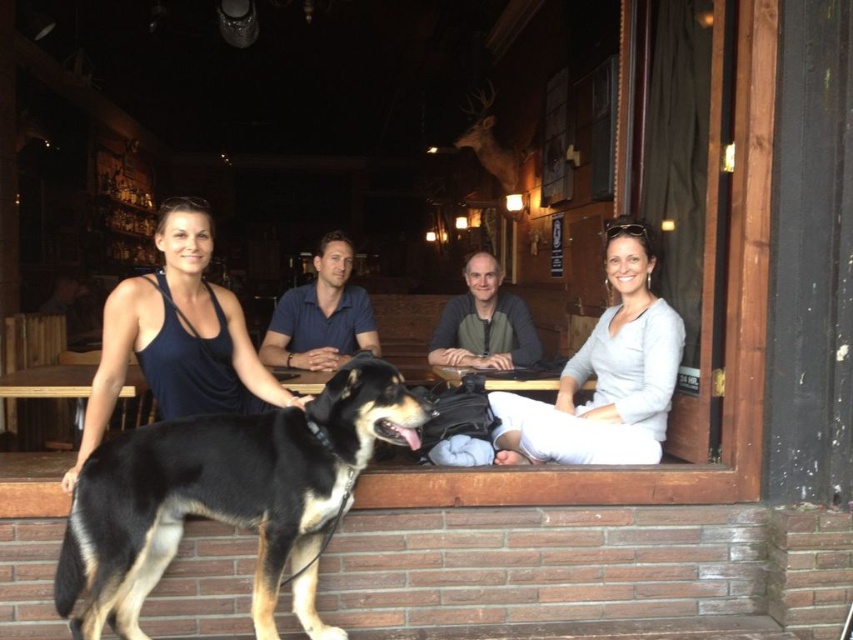
Can you confirm if light gray sweater at center is shorter than blue cotton shirt at center?

Incorrect, light gray sweater at center's height does not fall short of blue cotton shirt at center's.

Is light gray sweater at center to the right of blue cotton shirt at center from the viewer's perspective?

Indeed, light gray sweater at center is positioned on the right side of blue cotton shirt at center.

Between point (662, 321) and point (281, 362), which one is positioned in front?

Point (662, 321) is in front.

Identify the location of light gray sweater at center. The height and width of the screenshot is (640, 853). (605, 374).

Who is taller, black and tan fur dog at left or blue cotton shirt at center?

black and tan fur dog at left

Can you confirm if black and tan fur dog at left is positioned to the right of blue cotton shirt at center?

Yes, black and tan fur dog at left is to the right of blue cotton shirt at center.

Between point (312, 408) and point (343, 241), which one is positioned behind?

Point (343, 241)

You are a GUI agent. You are given a task and a screenshot of the screen. Output one action in this format:
    pyautogui.click(x=<x>, y=<y>)
    Task: Click on the black and tan fur dog at left
    This screenshot has width=853, height=640.
    Given the screenshot: What is the action you would take?
    (228, 497)

Which is more to the right, light gray sweater at center or gray knit sweater at center?

From the viewer's perspective, light gray sweater at center appears more on the right side.

Does light gray sweater at center have a lesser height compared to gray knit sweater at center?

No, light gray sweater at center is not shorter than gray knit sweater at center.

Who is more forward, (598, 336) or (444, 342)?

Positioned in front is point (598, 336).

Locate an element on the screen. light gray sweater at center is located at coordinates (605, 374).